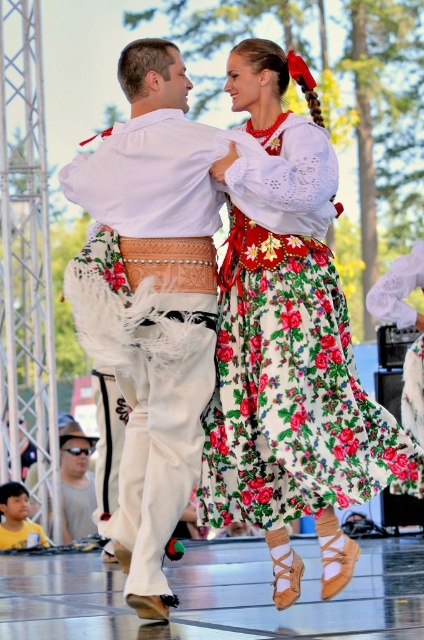
Question: From the image, what is the correct spatial relationship of floral cotton skirt at center in relation to white leather pants at center?

Choices:
 (A) left
 (B) right

Answer: (B)

Question: Is floral cotton skirt at center bigger than white leather pants at center?

Choices:
 (A) yes
 (B) no

Answer: (A)

Question: Is floral cotton skirt at center in front of white leather pants at center?

Choices:
 (A) yes
 (B) no

Answer: (A)

Question: Among these objects, which one is farthest from the camera?

Choices:
 (A) floral cotton skirt at center
 (B) white leather pants at center

Answer: (B)

Question: Which point is farther from the camera taking this photo?

Choices:
 (A) (108, 188)
 (B) (212, 509)

Answer: (B)